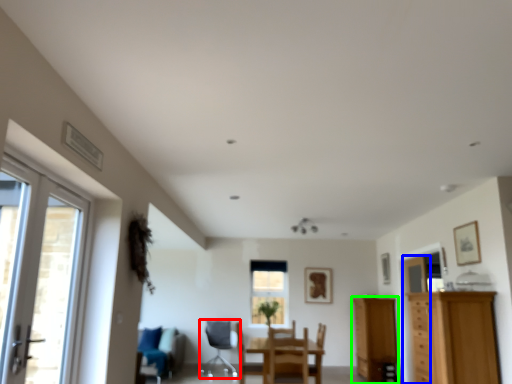
Question: Which is farther away from chair (highlighted by a red box)? door (highlighted by a blue box) or cabinetry (highlighted by a green box)?

Choices:
 (A) door
 (B) cabinetry

Answer: (A)